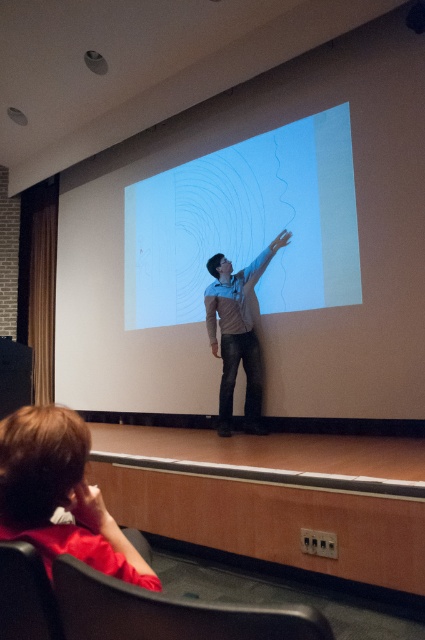
In the scene shown: Does black leather chair at lower left have a smaller size compared to denim jeans at center?

Indeed, black leather chair at lower left has a smaller size compared to denim jeans at center.

This screenshot has height=640, width=425. In order to click on black leather chair at lower left in this screenshot , I will do `click(167, 612)`.

The height and width of the screenshot is (640, 425). Identify the location of black leather chair at lower left. (167, 612).

Between denim jeans at center and black fabric chair at lower left, which one is positioned higher?

denim jeans at center

Does point (207, 269) come closer to viewer compared to point (0, 611)?

No.

This screenshot has width=425, height=640. Describe the element at coordinates (237, 332) in the screenshot. I see `denim jeans at center` at that location.

In order to click on denim jeans at center in this screenshot , I will do `click(237, 332)`.

Can you confirm if black leather chair at lower left is positioned to the left of black fabric chair at lower left?

Incorrect, black leather chair at lower left is not on the left side of black fabric chair at lower left.

This screenshot has height=640, width=425. What do you see at coordinates (167, 612) in the screenshot?
I see `black leather chair at lower left` at bounding box center [167, 612].

This screenshot has width=425, height=640. In order to click on black leather chair at lower left in this screenshot , I will do `click(167, 612)`.